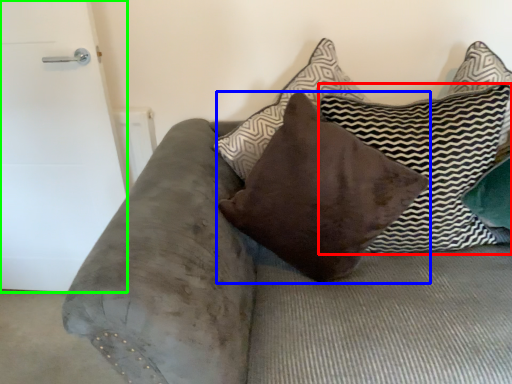
Question: Which object is positioned closest to pillow (highlighted by a red box)? Select from pillow (highlighted by a blue box) and door (highlighted by a green box).

Choices:
 (A) pillow
 (B) door

Answer: (A)